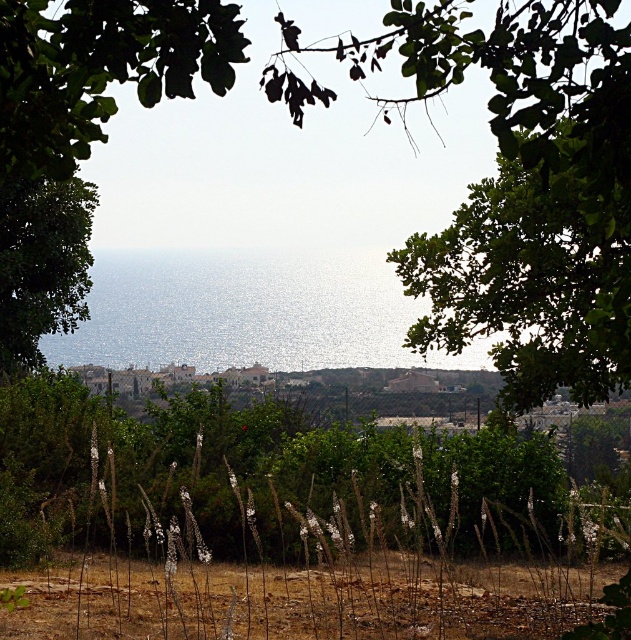
Question: Which of the following is the closest to the observer?

Choices:
 (A) (555, 605)
 (B) (30, 320)
 (C) (285, 253)
 (D) (572, 365)

Answer: (A)

Question: Does shiny blue water at center have a lesser width compared to green leafy tree at left?

Choices:
 (A) no
 (B) yes

Answer: (A)

Question: Which point is farther to the camera?

Choices:
 (A) (57, 186)
 (B) (475, 268)
 (C) (232, 593)

Answer: (A)

Question: Which point is farther from the camera taking this photo?

Choices:
 (A) (30, 296)
 (B) (153, 584)
 (C) (593, 308)
 (D) (209, 276)

Answer: (D)

Question: Is green leafy tree at upper right above green leafy tree at left?

Choices:
 (A) yes
 (B) no

Answer: (B)

Question: Can you confirm if brown dry soil at lower center is wider than green leafy tree at left?

Choices:
 (A) yes
 (B) no

Answer: (A)